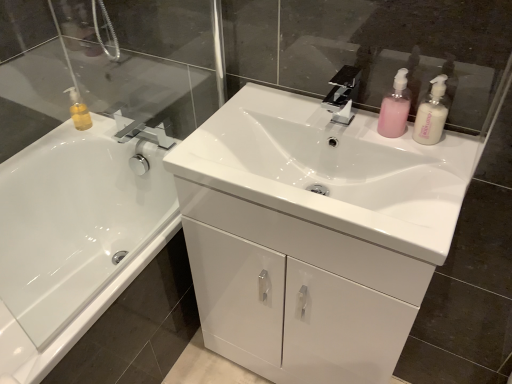
Locate an element on the screen. This screenshot has width=512, height=384. vacant space in front of pink matte pump bottle at upper right, acting as the second toiletry starting from the left is located at coordinates (411, 171).